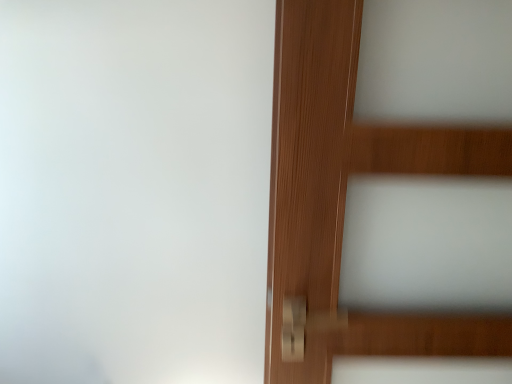
What is the approximate height of wooden door at right?

The height of wooden door at right is 38.80 inches.

Where is `wooden door at right`? The image size is (512, 384). wooden door at right is located at coordinates (345, 199).

What do you see at coordinates (345, 199) in the screenshot? I see `wooden door at right` at bounding box center [345, 199].

Find the location of a particular element. wooden door at right is located at coordinates (345, 199).